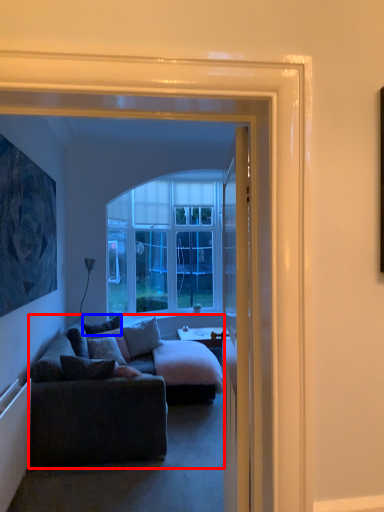
Question: Which of the following is the closest to the observer, studio couch (highlighted by a red box) or pillow (highlighted by a blue box)?

Choices:
 (A) studio couch
 (B) pillow

Answer: (A)